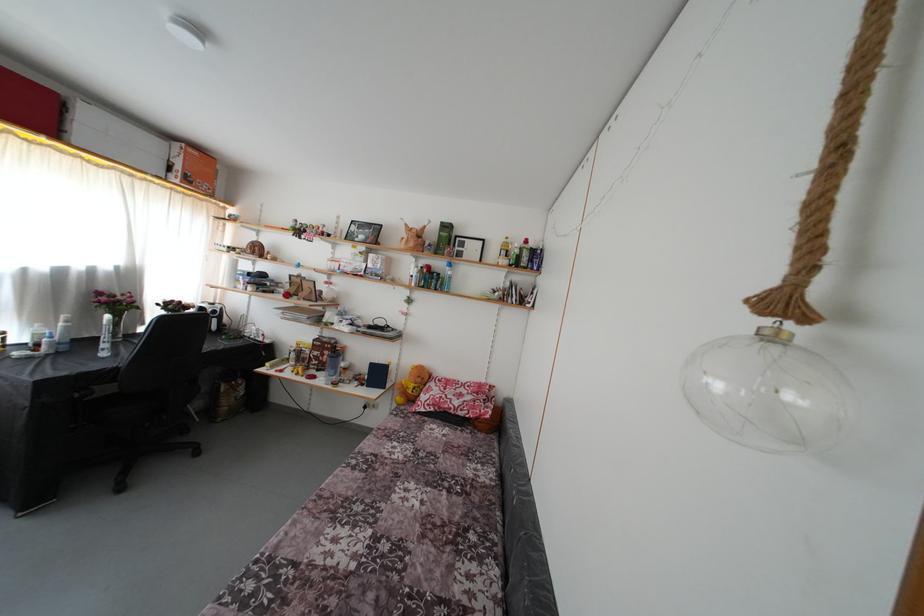
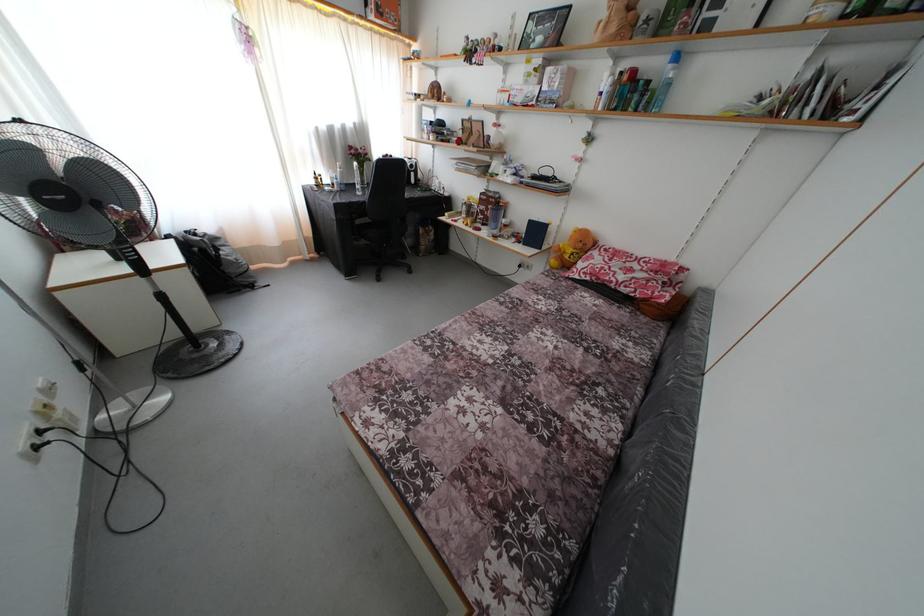
In the second image, find the point that corresponds to point 453,274 in the first image.

(675, 73)